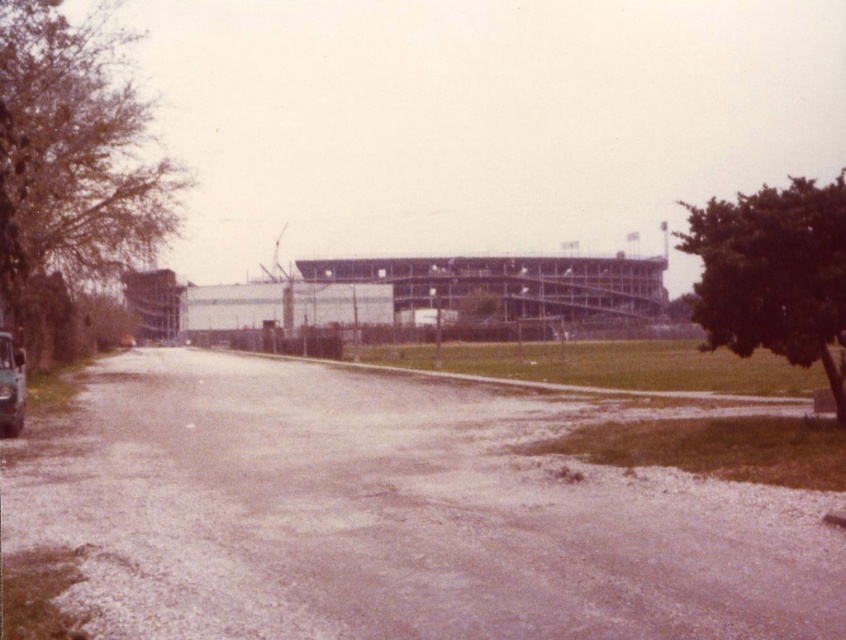
This screenshot has height=640, width=846. Describe the element at coordinates (773, 275) in the screenshot. I see `green leafy tree at right` at that location.

Is point (784, 202) more distant than point (3, 406)?

No, (784, 202) is closer to viewer.

Find the location of a particular element. This screenshot has width=846, height=640. green leafy tree at right is located at coordinates (773, 275).

Is brown gravel road at center positioned in front of shiny metallic car at left?

Yes, brown gravel road at center is in front of shiny metallic car at left.

Is point (194, 621) farther from viewer compared to point (15, 365)?

No, it is in front of (15, 365).

Is point (720, 634) farther from viewer compared to point (25, 378)?

No, it is in front of (25, 378).

This screenshot has height=640, width=846. What are the coordinates of `brown gravel road at center` in the screenshot? It's located at 396,516.

Who is positioned more to the left, green leafy tree at left or shiny metallic car at left?

green leafy tree at left

Who is higher up, green leafy tree at left or shiny metallic car at left?

Positioned higher is green leafy tree at left.

Is point (9, 288) farther from camera compared to point (15, 397)?

Yes, it is.

You are a GUI agent. You are given a task and a screenshot of the screen. Output one action in this format:
    pyautogui.click(x=<x>, y=<y>)
    Task: Click on the green leafy tree at left
    This screenshot has width=846, height=640.
    Given the screenshot: What is the action you would take?
    pyautogui.click(x=70, y=168)